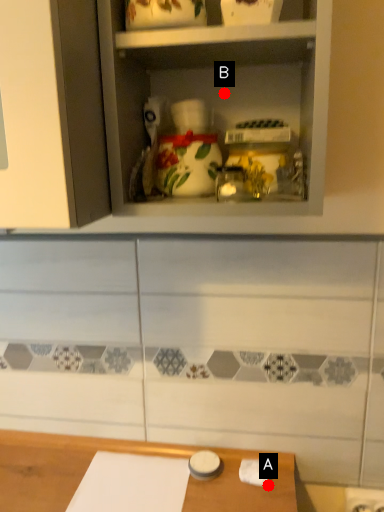
Question: Two points are circled on the image, labeled by A and B beside each circle. Which point appears farthest from the camera in this image?

Choices:
 (A) A is further
 (B) B is further

Answer: (A)